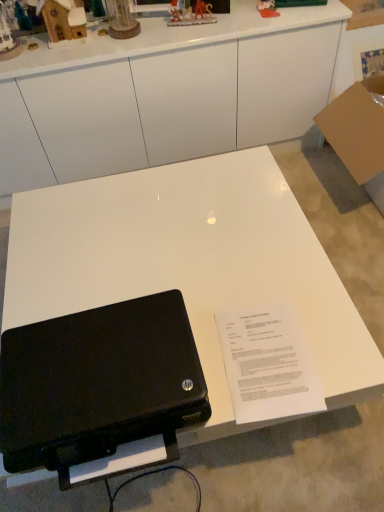
Locate an element on the screen. vacant space positioned to the left of matte wooden clock at upper center, the third toy viewed from the right is located at coordinates (82, 42).